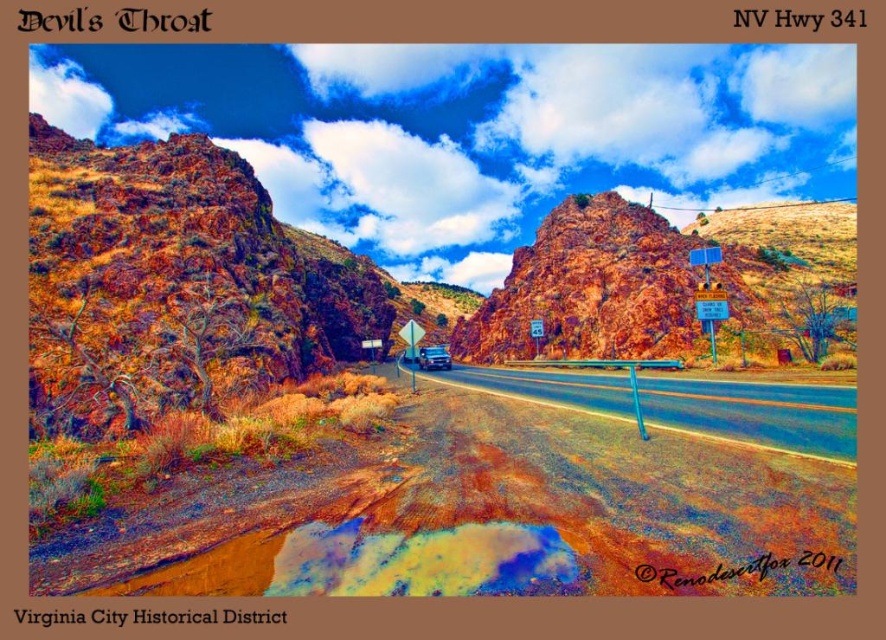
Question: Which point is closer to the camera taking this photo?

Choices:
 (A) (737, 289)
 (B) (53, 323)

Answer: (B)

Question: Is rustic rock formation at center positioned behind smooth asphalt highway at center?

Choices:
 (A) yes
 (B) no

Answer: (A)

Question: Can you confirm if rusty rock formation at left is thinner than yellow plastic sign at right?

Choices:
 (A) no
 (B) yes

Answer: (A)

Question: Observing the image, what is the correct spatial positioning of rusty rock formation at left in reference to metallic silver car at center?

Choices:
 (A) right
 (B) left

Answer: (B)

Question: Based on their relative distances, which object is nearer to the rustic rock formation at center?

Choices:
 (A) rusty rock formation at left
 (B) smooth asphalt highway at center
 (C) yellow plastic sign at right

Answer: (B)

Question: Which of these objects is positioned farthest from the rusty rock formation at left?

Choices:
 (A) smooth asphalt highway at center
 (B) rustic rock formation at center
 (C) dried mud path at lower left
 (D) yellow plastic sign at right

Answer: (B)